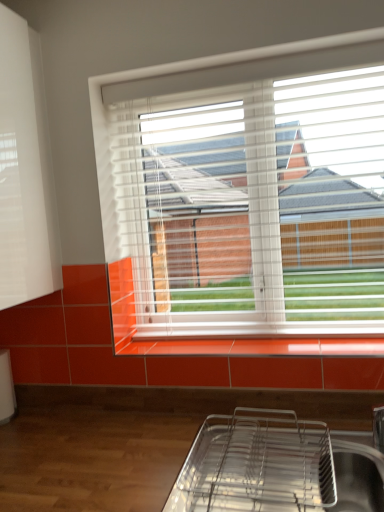
Question: From a real-world perspective, is metallic silver tray at lower center below white matte shutter at upper left?

Choices:
 (A) no
 (B) yes

Answer: (B)

Question: Does metallic silver tray at lower center come in front of white matte shutter at upper left?

Choices:
 (A) no
 (B) yes

Answer: (B)

Question: Is metallic silver tray at lower center far from white matte shutter at upper left?

Choices:
 (A) no
 (B) yes

Answer: (A)

Question: Does metallic silver tray at lower center have a larger size compared to white matte shutter at upper left?

Choices:
 (A) no
 (B) yes

Answer: (A)

Question: Is metallic silver tray at lower center positioned with its back to white matte shutter at upper left?

Choices:
 (A) no
 (B) yes

Answer: (A)

Question: Is white matte shutter at upper left bigger or smaller than metallic silver tray at lower center?

Choices:
 (A) big
 (B) small

Answer: (A)

Question: Considering their positions, is white matte shutter at upper left located in front of or behind metallic silver tray at lower center?

Choices:
 (A) front
 (B) behind

Answer: (B)

Question: From the image's perspective, is white matte shutter at upper left positioned above or below metallic silver tray at lower center?

Choices:
 (A) below
 (B) above

Answer: (B)

Question: From a real-world perspective, is white matte shutter at upper left above or below metallic silver tray at lower center?

Choices:
 (A) below
 (B) above

Answer: (B)

Question: Looking at their shapes, would you say metallic silver tray at lower center is wider or thinner than white matte shutter at upper left?

Choices:
 (A) thin
 (B) wide

Answer: (B)

Question: Relative to white matte shutter at upper left, is metallic silver tray at lower center in front or behind?

Choices:
 (A) behind
 (B) front

Answer: (B)

Question: In the image, is metallic silver tray at lower center on the left side or the right side of white matte shutter at upper left?

Choices:
 (A) right
 (B) left

Answer: (A)

Question: From the image's perspective, relative to white matte shutter at upper left, is metallic silver tray at lower center above or below?

Choices:
 (A) below
 (B) above

Answer: (A)

Question: Would you say metallic silver tray at lower center is inside or outside orange glossy tile at lower center?

Choices:
 (A) inside
 (B) outside

Answer: (B)

Question: From a real-world perspective, relative to orange glossy tile at lower center, is metallic silver tray at lower center vertically above or below?

Choices:
 (A) below
 (B) above

Answer: (A)